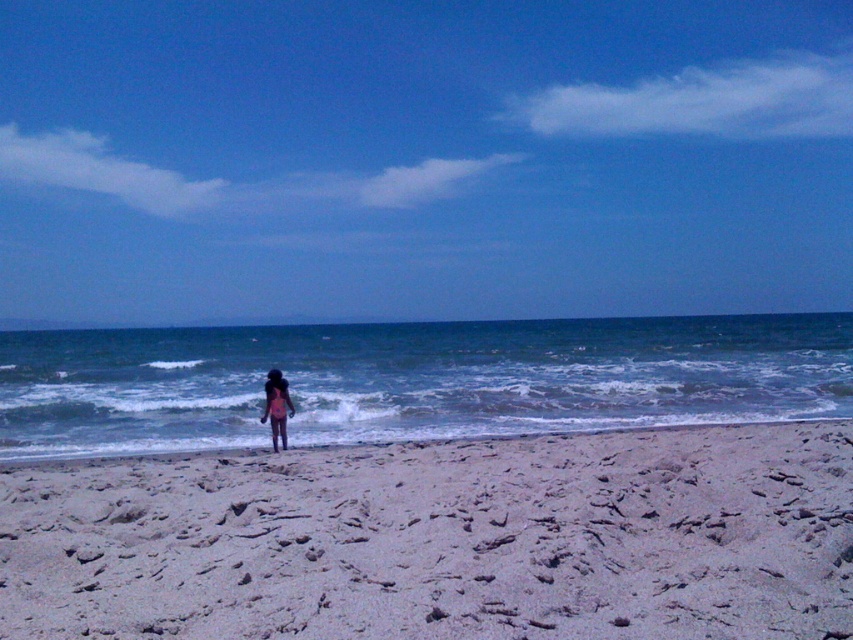
You are a photographer trying to capture the pink fabric bikini at center and the blue water at center in a single shot. Based on their positions, which object will appear closer to the top edge of the photo?

The blue water at center is taller than the pink fabric bikini at center, so the blue water at center will appear closer to the top edge of the photo.